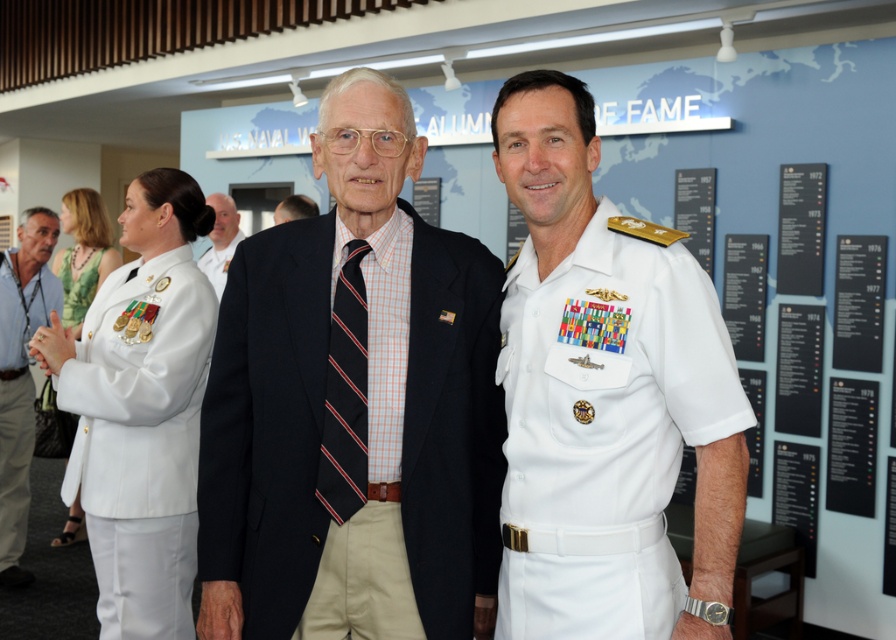
Question: Does white cotton shirt at center have a smaller size compared to matte black suit at center?

Choices:
 (A) no
 (B) yes

Answer: (B)

Question: Does black striped tie at center have a greater width compared to matte black suit at center?

Choices:
 (A) yes
 (B) no

Answer: (B)

Question: Which object is positioned farthest from the white uniform at center?

Choices:
 (A) blue shirt at left
 (B) white cotton shirt at center
 (C) navy blue fabric suit at center
 (D) black striped tie at center

Answer: (A)

Question: Among these objects, which one is nearest to the camera?

Choices:
 (A) black striped tie at center
 (B) white uniform at center
 (C) white glossy uniform at left
 (D) navy blue fabric suit at center

Answer: (B)

Question: Is black striped tie at center bigger than matte black suit at center?

Choices:
 (A) yes
 (B) no

Answer: (B)

Question: Which of the following is the farthest from the observer?

Choices:
 (A) white glossy uniform at left
 (B) white cotton shirt at center
 (C) matte black suit at center
 (D) blue shirt at left

Answer: (C)